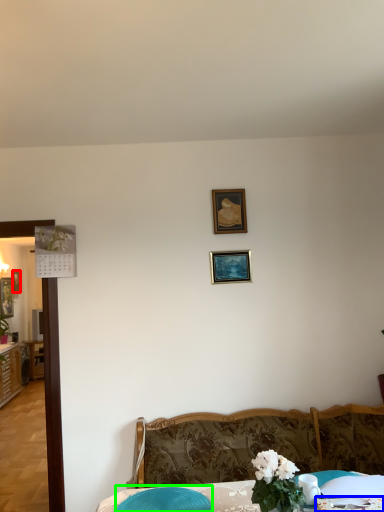
Question: Which is nearer to the picture frame (highlighted by a red box)? tablecloth (highlighted by a blue box) or swivel chair (highlighted by a green box).

Choices:
 (A) tablecloth
 (B) swivel chair

Answer: (B)